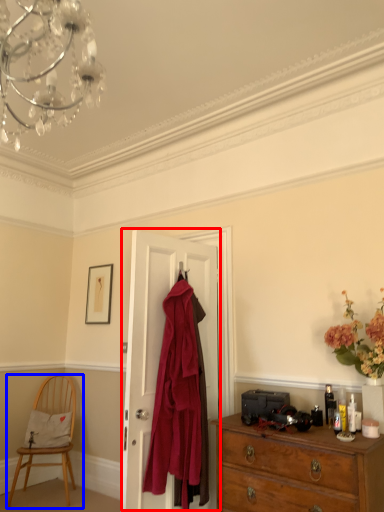
Question: Among these objects, which one is nearest to the camera, door (highlighted by a red box) or chair (highlighted by a blue box)?

Choices:
 (A) door
 (B) chair

Answer: (A)